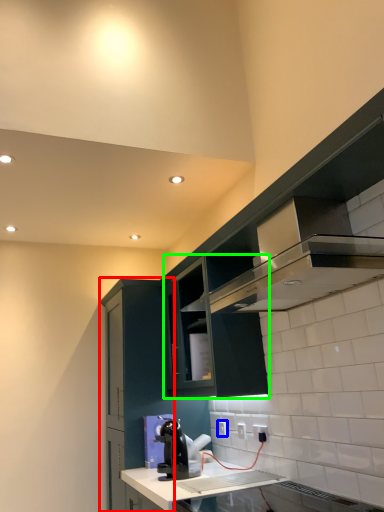
Question: Considering the real-world distances, which object is farthest from cabinetry (highlighted by a red box)? electric outlet (highlighted by a blue box) or cabinetry (highlighted by a green box)?

Choices:
 (A) electric outlet
 (B) cabinetry

Answer: (A)